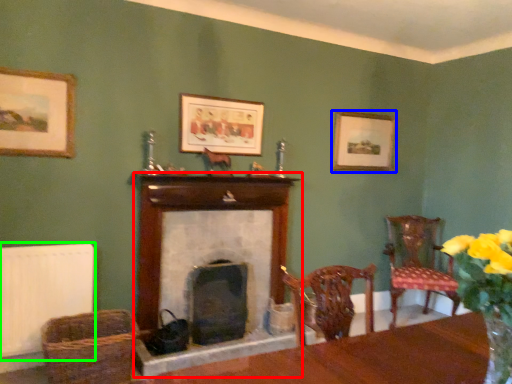
Question: Based on their relative distances, which object is farther from fireplace (highlighted by a red box)? Choose from picture frame (highlighted by a blue box) and radiator (highlighted by a green box).

Choices:
 (A) picture frame
 (B) radiator

Answer: (A)